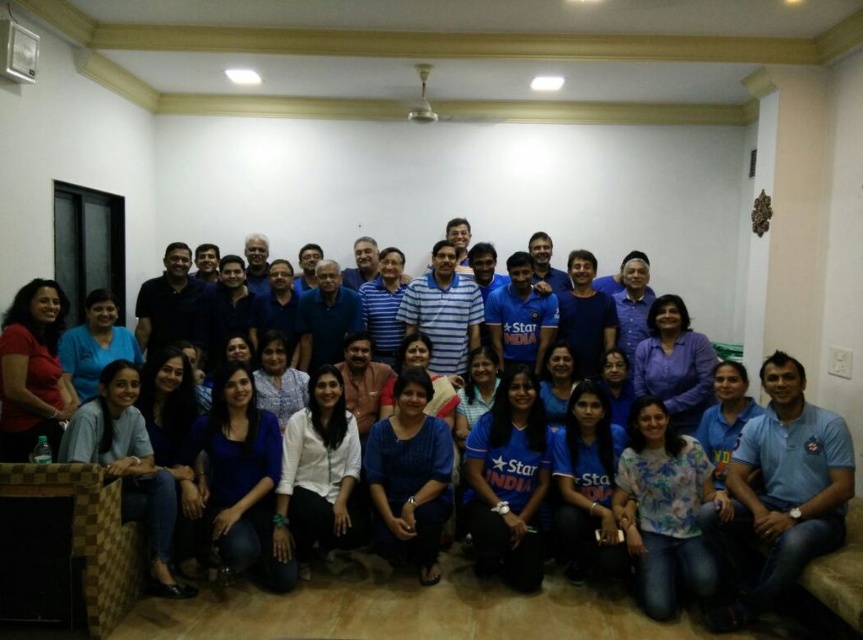
You are organizing a group photo and need to ensure that the blue cotton shirt at center and the blue cotton polo shirt at lower right are positioned correctly. Based on the scene description, which shirt is positioned to the left of the other?

The blue cotton shirt at center is to the left of the blue cotton polo shirt at lower right.

You are organizing a group photo and need to ensure that the blue cotton shirt at center and the matte red shirt at left are positioned correctly according to the scene description. Based on their positions, which shirt should be visible first when looking at the photo from the front?

The blue cotton shirt at center is in front of the matte red shirt at left, so the blue cotton shirt at center should be visible first when looking at the photo from the front.